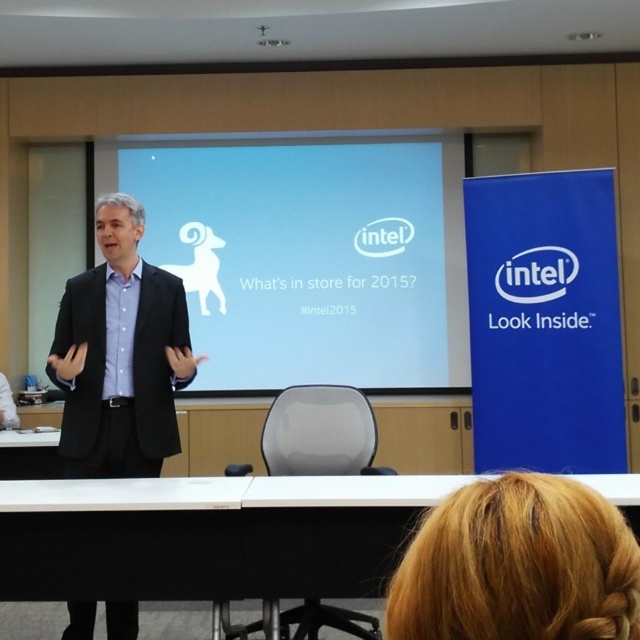
You are an attendee at the presentation and want to take a photo of the white glossy screen at center and the black suit at center. Which one is wider in the image?

The white glossy screen at center is wider than the black suit at center.

In the scene shown: You are an attendee at the presentation and want to know which of the two points, point (461,625) or point (64,468), is closer to you. Can you determine this based on the scene?

Point (461,625) is closer to the viewer than point (64,468).

You are an attendee at this presentation and want to take a photo of the presenter. Since you want to capture both the presenter and the key elements on the screen, which object from the scene should you focus on to ensure the black suit at center and the blonde hair at upper right are both in frame?

You should focus on the black suit at center because it occupies more space than the blonde hair at upper right, ensuring both are visible in the photo.